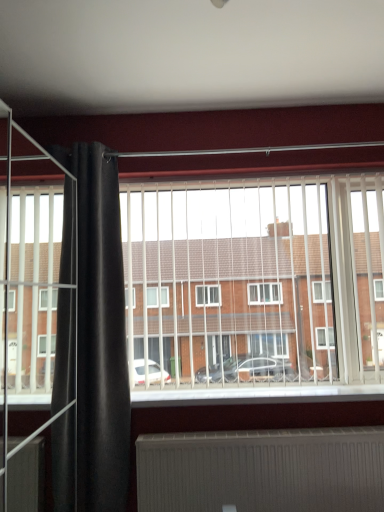
Question: Is white plastic blinds at center inside or outside of white ribbed radiator at lower center?

Choices:
 (A) inside
 (B) outside

Answer: (B)

Question: Is white plastic blinds at center wider or thinner than white ribbed radiator at lower center?

Choices:
 (A) wide
 (B) thin

Answer: (A)

Question: Which object is the closest to the white plastic blinds at center?

Choices:
 (A) black velvet curtain at left
 (B) white ribbed radiator at lower center

Answer: (A)

Question: Which object is positioned farthest from the black velvet curtain at left?

Choices:
 (A) white plastic blinds at center
 (B) white ribbed radiator at lower center

Answer: (B)